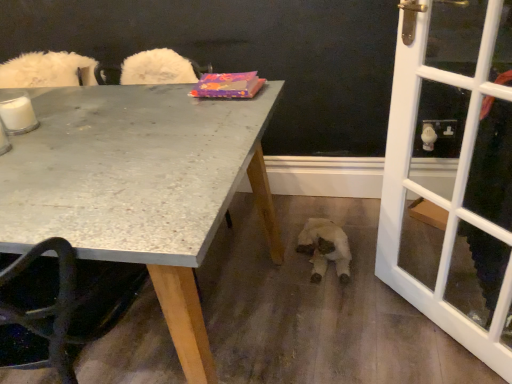
Locate an element on the screen. The height and width of the screenshot is (384, 512). spots to the right of white plush toy at lower center is located at coordinates (397, 247).